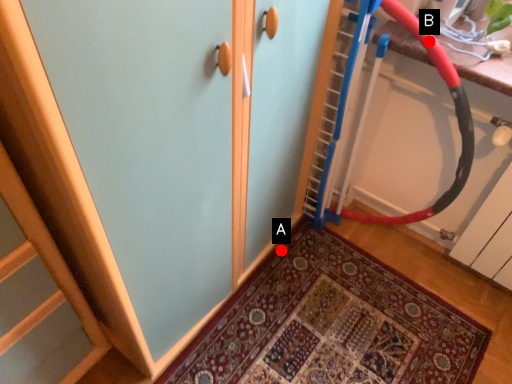
Question: Two points are circled on the image, labeled by A and B beside each circle. Which point appears farthest from the camera in this image?

Choices:
 (A) A is further
 (B) B is further

Answer: (A)